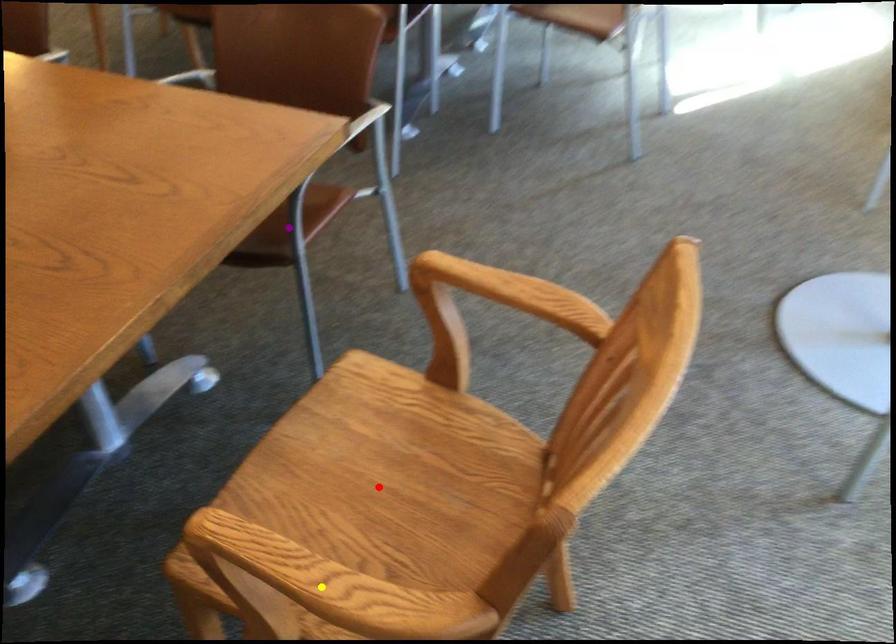
Order these from nearest to farthest:
A) red point
B) purple point
C) yellow point

yellow point < red point < purple point